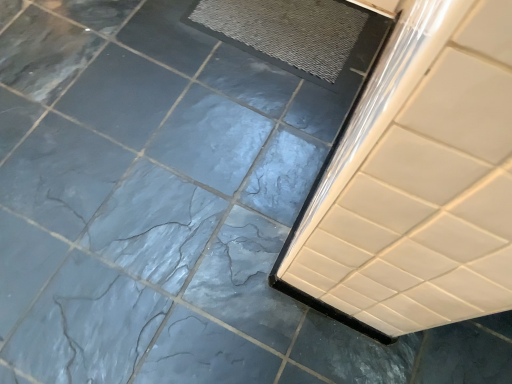
Question: Should I look upward or downward to see textured gray mat at upper center?

Choices:
 (A) up
 (B) down

Answer: (A)